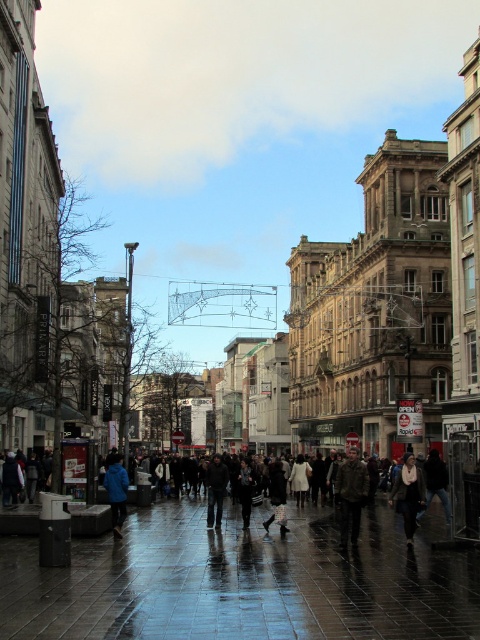
In the scene shown: You are a delivery person trying to navigate through the street. You need to pass between the glossy tile pavement at center and the dark blue jacket at center. Can you fit through the space between them?

The glossy tile pavement at center is narrower than the dark blue jacket at center, so the space between them is not wide enough for a delivery person to pass through safely.

You are standing on the street and want to take a photo of both point (x=82, y=509) and point (x=212, y=518) in the image. Which point will appear larger in your photo?

Point (x=82, y=509) is closer to the camera than point (x=212, y=518), so it will appear larger in the photo.

You are standing on the sidewalk and want to step onto the glossy tile pavement at center. Based on its 2D coordinates, where exactly should you aim to place your foot?

You should aim to place your foot at the point with coordinates 0.911 in the x axis and 0.502 in the y axis, as that is the 2D location of the glossy tile pavement at center.